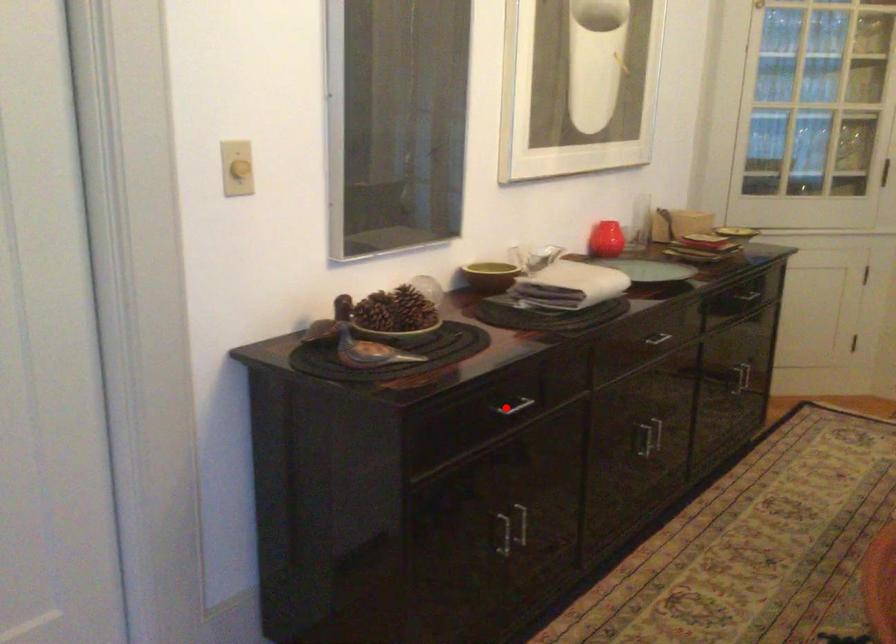
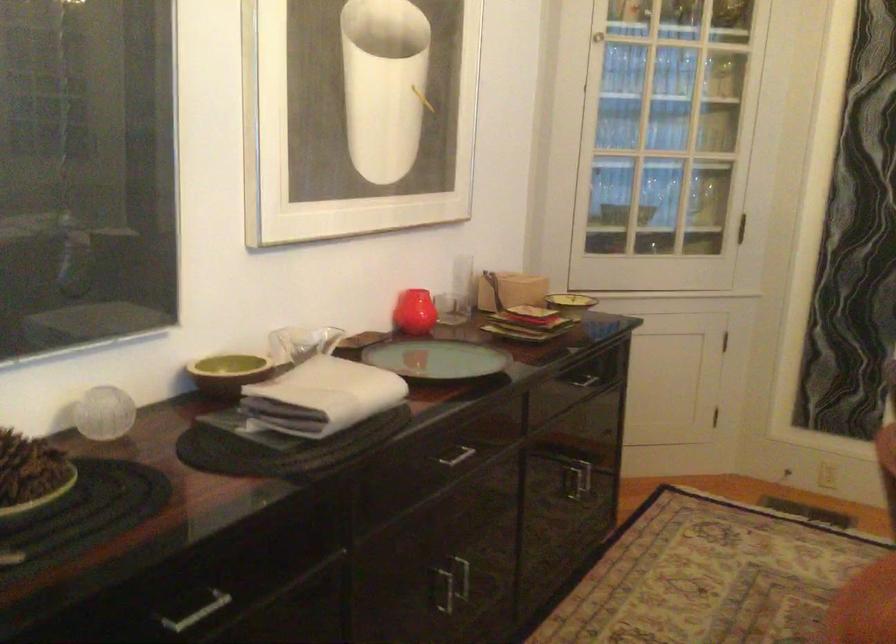
Question: I am providing you with two images of the same scene from different viewpoints. Given a red point in image1, look at the same physical point in image2. Is it:

Choices:
 (A) Closer to the viewpoint
 (B) Farther from the viewpoint

Answer: (A)